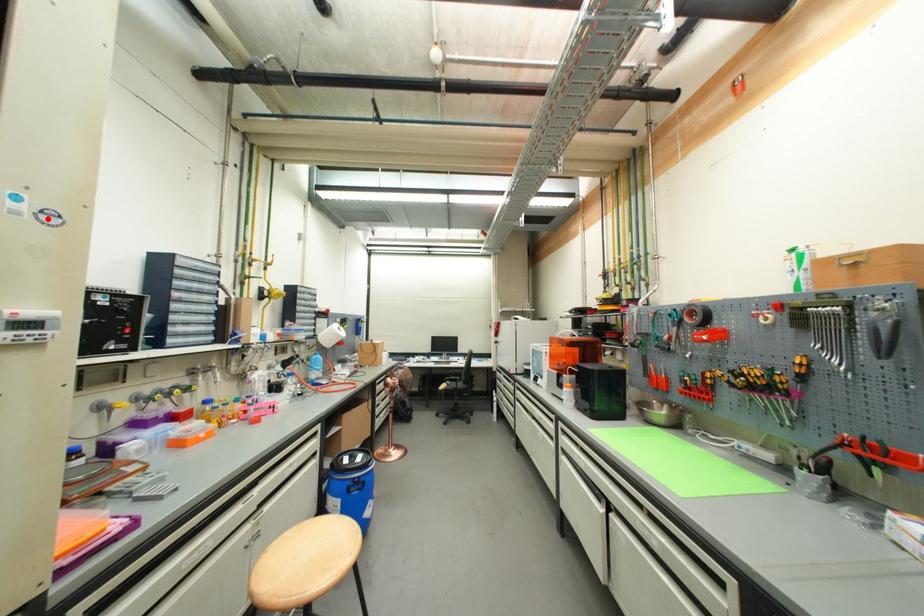
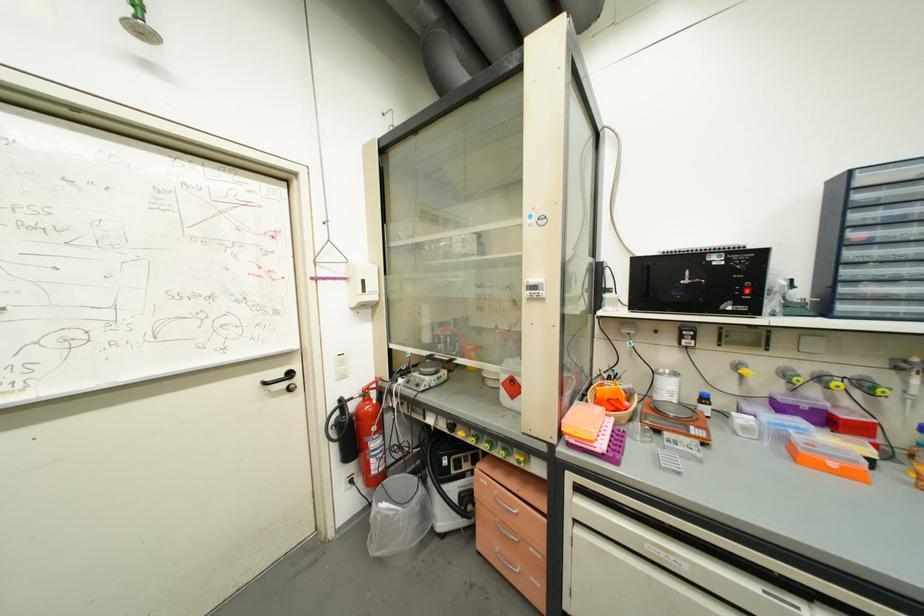
Where in the second image is the point corresponding to the highlighted location from the first image?

(544, 224)